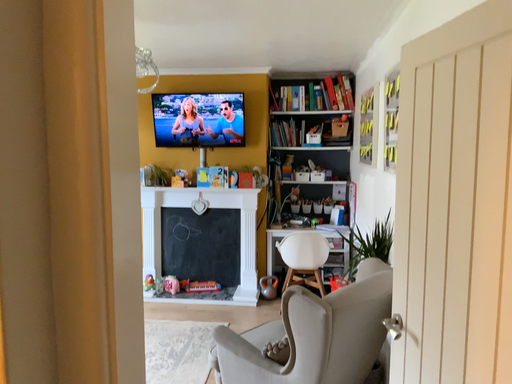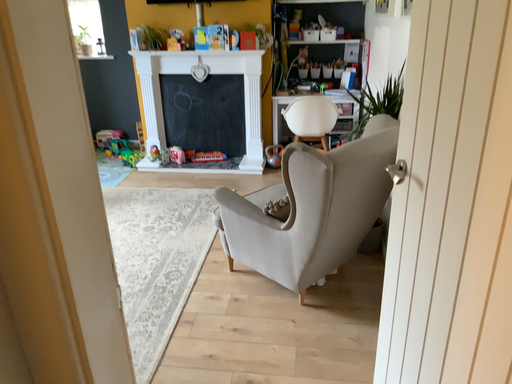
Question: How did the camera likely rotate when shooting the video?

Choices:
 (A) rotated upward
 (B) rotated downward

Answer: (B)